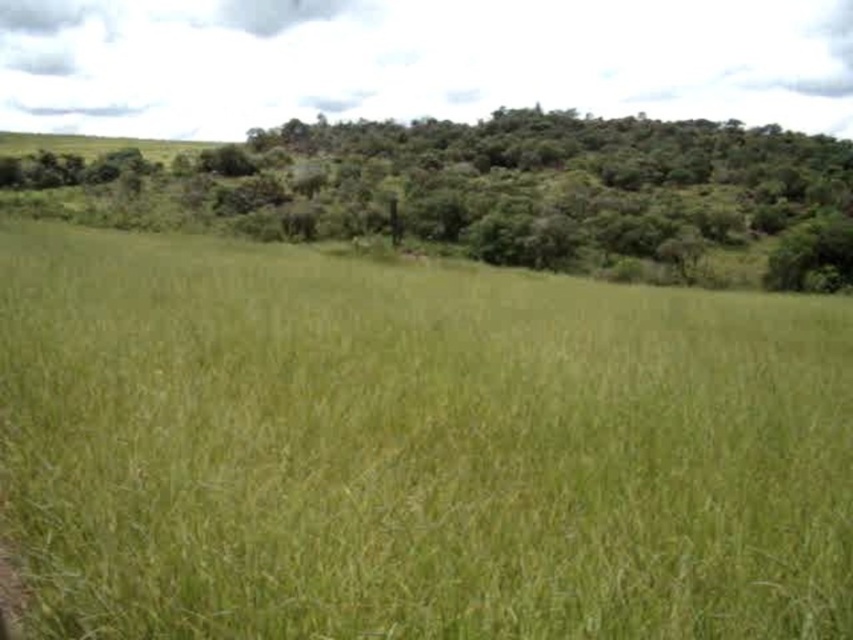
You are standing on the green grassy field at center and want to look up at the green leafy tree at upper center. Which direction should you look to see the tree?

You should look upward because the green grassy field at center is located below the green leafy tree at upper center.